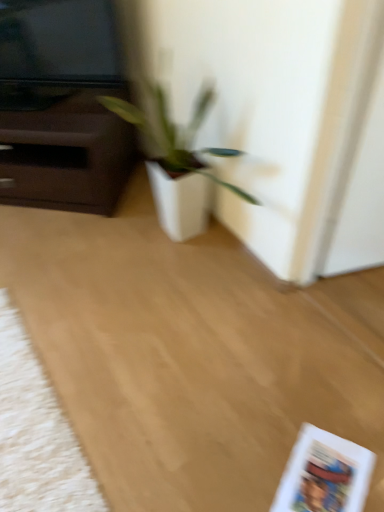
In order to click on vacant area that lies between white matte pot at center and white fluffy mat at lower left in this screenshot , I will do `click(115, 357)`.